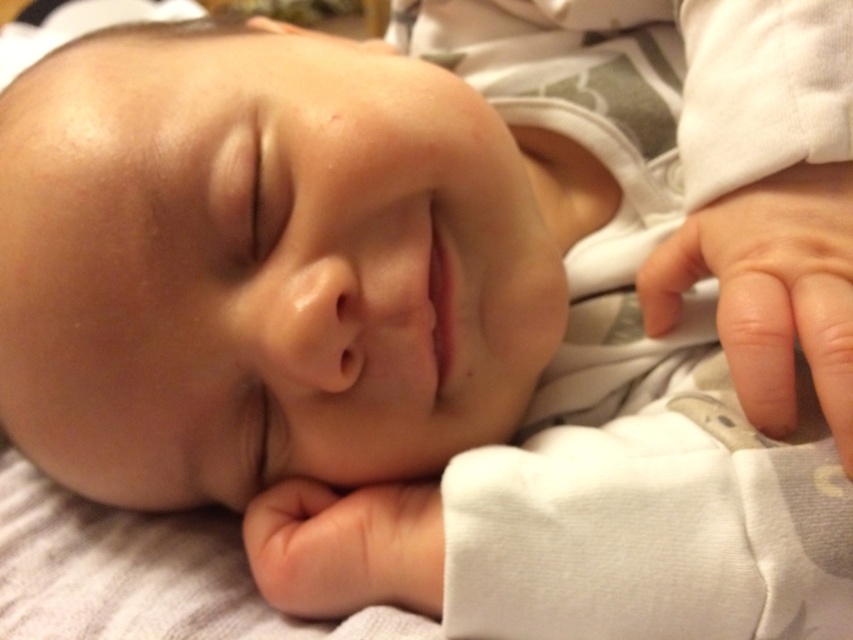
What do you see at coordinates (770, 291) in the screenshot? I see `smooth skin hand at lower right` at bounding box center [770, 291].

Can you confirm if smooth skin hand at lower right is positioned above smooth skin hand at lower center?

Indeed, smooth skin hand at lower right is positioned over smooth skin hand at lower center.

What do you see at coordinates (770, 291) in the screenshot? I see `smooth skin hand at lower right` at bounding box center [770, 291].

In order to click on smooth skin hand at lower right in this screenshot , I will do `click(770, 291)`.